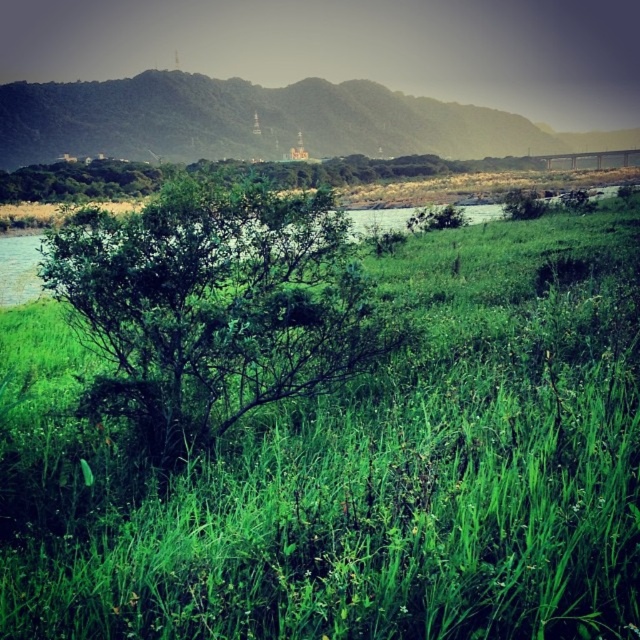
Question: Which point is farther from the camera taking this photo?

Choices:
 (A) (353, 481)
 (B) (237, 364)

Answer: (B)

Question: Which of the following is the closest to the observer?

Choices:
 (A) green leafy grass at center
 (B) green grassy hill at upper center

Answer: (A)

Question: Is green leafy grass at center to the left of green grassy hill at upper center from the viewer's perspective?

Choices:
 (A) no
 (B) yes

Answer: (A)

Question: Is green leafy bush at center wider than green grassy hill at upper center?

Choices:
 (A) yes
 (B) no

Answer: (B)

Question: Which of the following is the farthest from the observer?

Choices:
 (A) (106, 614)
 (B) (275, 150)
 (C) (246, 212)

Answer: (B)

Question: Is green leafy grass at center above green grassy hill at upper center?

Choices:
 (A) no
 (B) yes

Answer: (A)